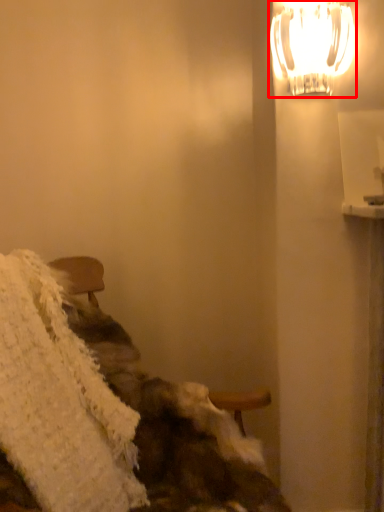
Question: Where is lamp (annotated by the red box) located in relation to blanket in the image?

Choices:
 (A) left
 (B) right

Answer: (B)